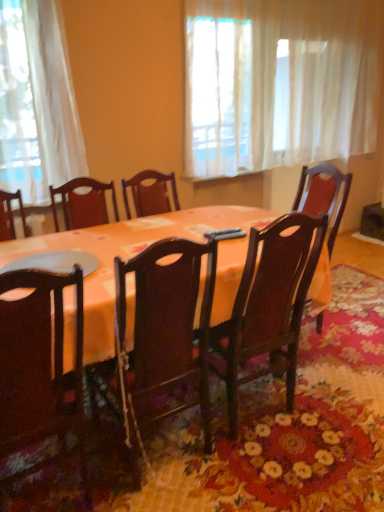
Locate an element on the screen. The height and width of the screenshot is (512, 384). vacant area that lies to the right of wooden chair at center, positioned as the second chair in left-to-right order is located at coordinates (336, 397).